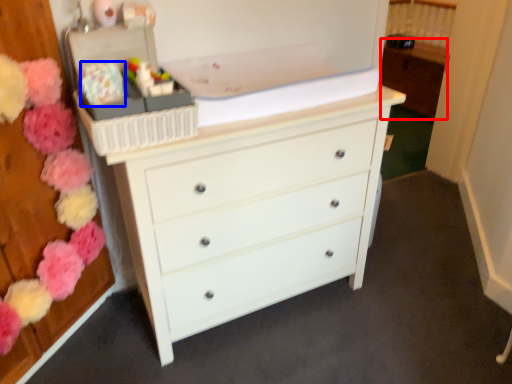
Question: Which object appears closest to the camera in this image, cabinetry (highlighted by a red box) or flower (highlighted by a blue box)?

Choices:
 (A) cabinetry
 (B) flower

Answer: (B)